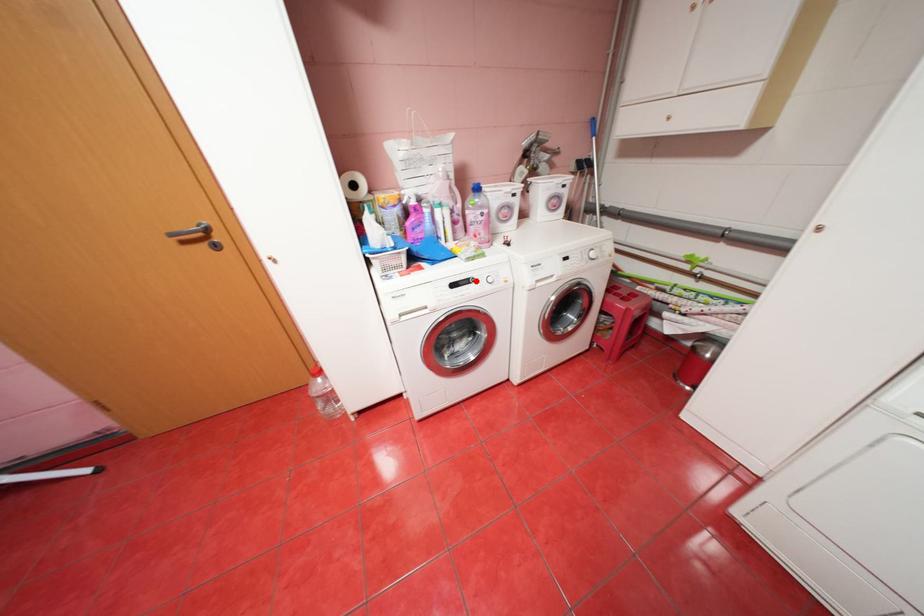
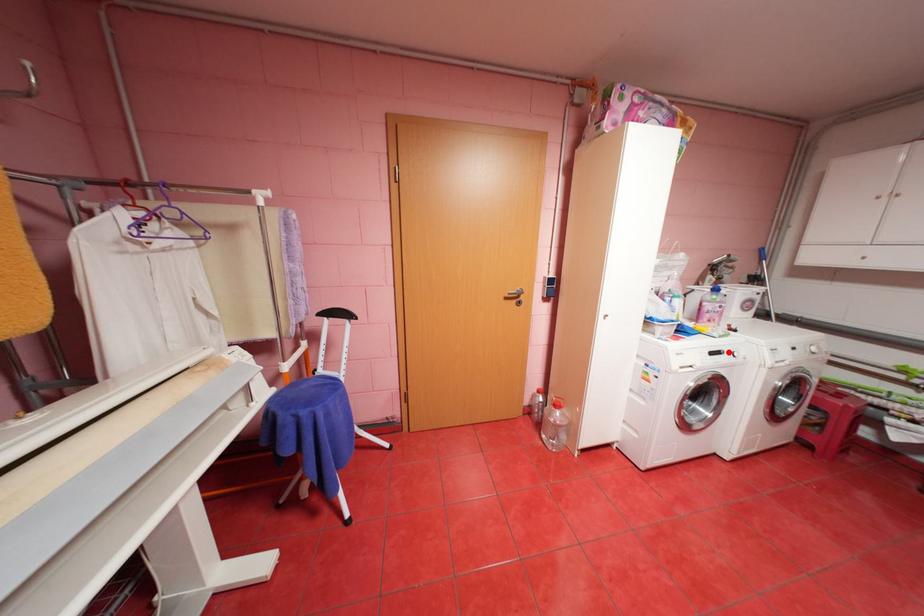
I am providing you with two images of the same scene from different viewpoints. A red point is marked on the first image and another point is marked on the second image. Does the point marked in image1 correspond to the same location as the one in image2?

Yes